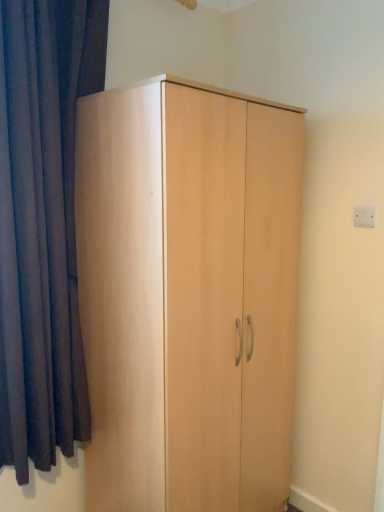
Question: Does point (77, 161) appear closer or farther from the camera than point (46, 415)?

Choices:
 (A) farther
 (B) closer

Answer: (A)

Question: Is light wood wardrobe at center bigger or smaller than dark blue fabric at left?

Choices:
 (A) small
 (B) big

Answer: (B)

Question: Estimate the real-world distances between objects in this image. Which object is closer to the light wood wardrobe at center?

Choices:
 (A) white plastic electric outlet at upper right
 (B) dark blue fabric at left

Answer: (B)

Question: Considering the real-world distances, which object is closest to the light wood wardrobe at center?

Choices:
 (A) dark blue fabric at left
 (B) white plastic electric outlet at upper right

Answer: (A)